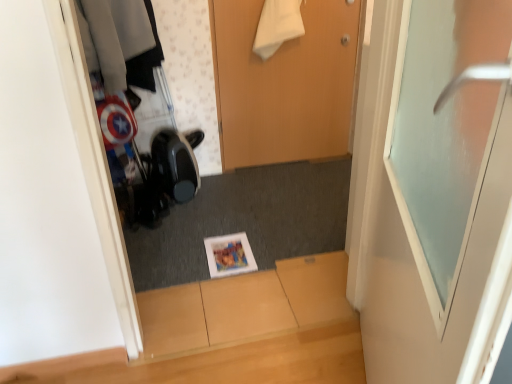
Locate an element on the screen. The width and height of the screenshot is (512, 384). free region under matte paper magazine at center (from a real-world perspective) is located at coordinates (230, 252).